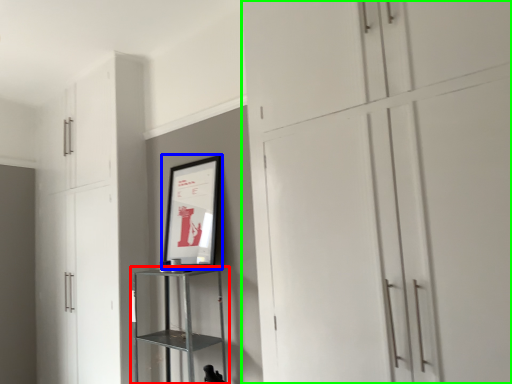
Question: Which object is positioned farthest from shelf (highlighted by a red box)? Select from picture frame (highlighted by a blue box) and cupboard (highlighted by a green box).

Choices:
 (A) picture frame
 (B) cupboard

Answer: (B)